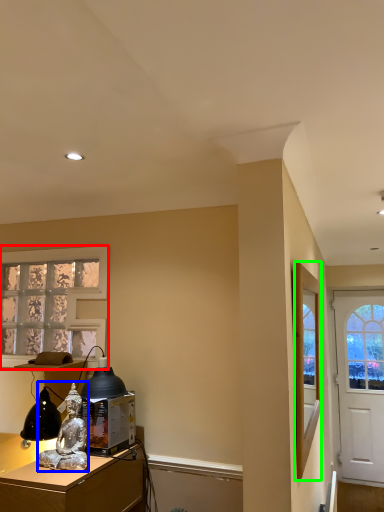
Question: Estimate the real-world distances between objects in this image. Which object is farther from window (highlighted by a red box), person (highlighted by a blue box) or mirror (highlighted by a green box)?

Choices:
 (A) person
 (B) mirror

Answer: (B)